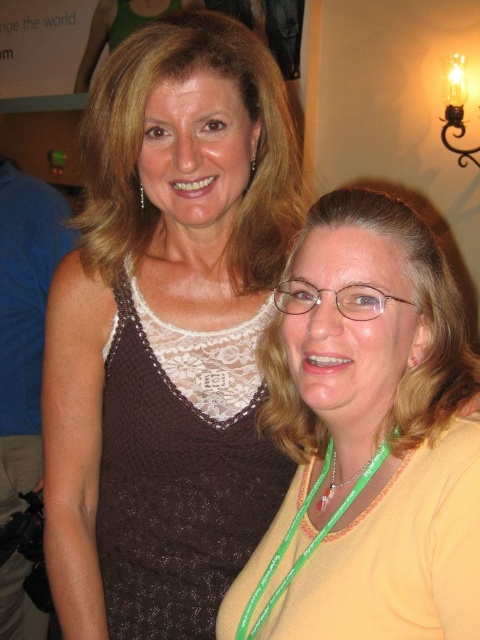
You are a photographer adjusting your camera focus. You need to focus on both the point at (x=104, y=96) and the point at (x=456, y=312). Which point should you focus on first to ensure both are in focus?

You should focus on point (x=104, y=96) first because it is closer to the camera than point (x=456, y=312). By focusing on the closer point, the depth of field may also cover the farther point.

From the picture: You are at a party and want to take a photo of the yellow fabric at center and the brown knitted dress at left. Which object is positioned higher in the frame?

The yellow fabric at center is positioned higher in the frame than the brown knitted dress at left.

You are a photographer setting up for a group photo. You need to ensure that the yellow fabric at center and the brown knitted dress at left are both in focus. The camera you are using has a depth of field that can cover 4 feet. Will both objects be in focus if they are positioned exactly as shown in the image?

The distance between the yellow fabric at center and the brown knitted dress at left is 4.34 feet. Since the depth of field can only cover 4 feet, the two objects are slightly beyond the camera settings. Therefore, they might not both be in focus simultaneously.